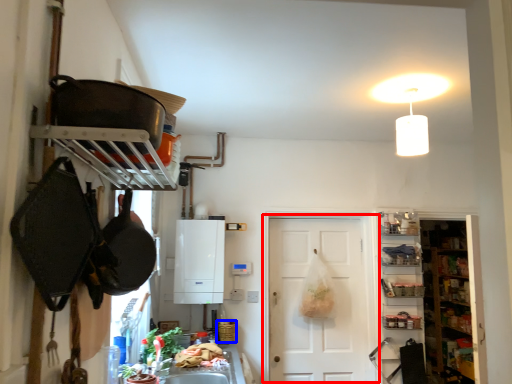
Question: Among these objects, which one is nearest to the camera, door (highlighted by a red box) or basket (highlighted by a blue box)?

Choices:
 (A) door
 (B) basket

Answer: (B)